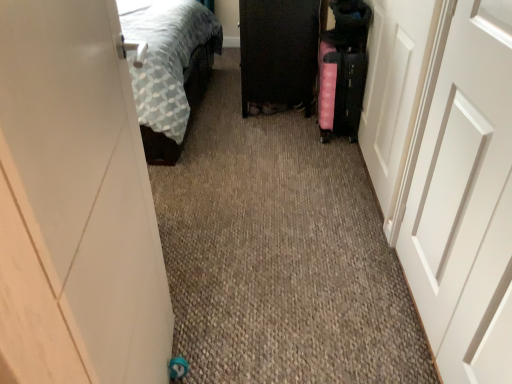
Locate an element on the screen. The height and width of the screenshot is (384, 512). free space between pink fabric suitcase at right and white matte door at right, arranged as the 2th door when viewed from the right is located at coordinates (358, 213).